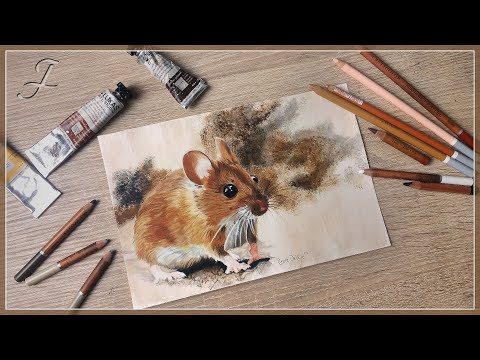
This screenshot has height=360, width=480. What are the coordinates of `piece of paper` in the screenshot? It's located at (318, 217).